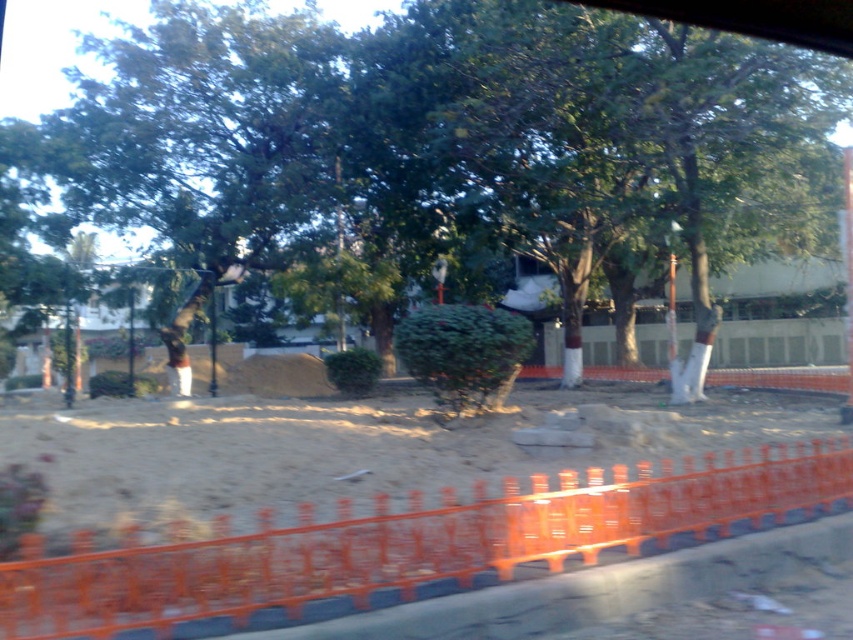
Question: Which object is the closest to the green leafy tree at center?

Choices:
 (A) brown fabric construction worker at center
 (B) orange plastic barricade at lower center

Answer: (A)

Question: Which object appears farthest from the camera in this image?

Choices:
 (A) orange plastic barricade at lower center
 (B) brown fabric construction worker at center
 (C) green leafy tree at center

Answer: (B)

Question: Is green leafy tree at center thinner than brown fabric construction worker at center?

Choices:
 (A) yes
 (B) no

Answer: (B)

Question: Is orange plastic barricade at lower center behind green leafy tree at center?

Choices:
 (A) yes
 (B) no

Answer: (B)

Question: Does orange plastic barricade at lower center have a smaller size compared to brown fabric construction worker at center?

Choices:
 (A) no
 (B) yes

Answer: (B)

Question: Which point appears closest to the camera in this image?

Choices:
 (A) (830, 36)
 (B) (180, 374)

Answer: (A)